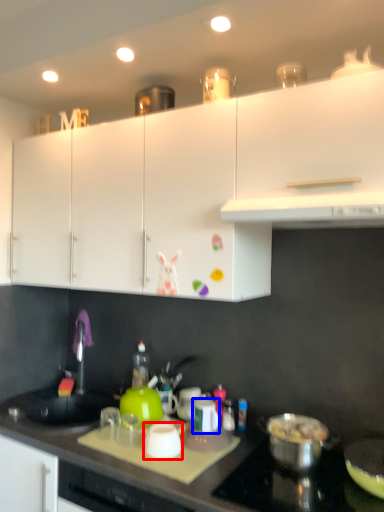
Question: Which object appears closest to the camera in this image, kitchen appliance (highlighted by a red box) or kitchen appliance (highlighted by a blue box)?

Choices:
 (A) kitchen appliance
 (B) kitchen appliance

Answer: (A)